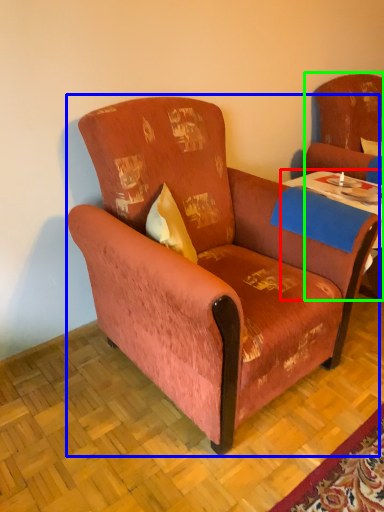
Question: Considering the real-world distances, which object is farthest from table (highlighted by a red box)? chair (highlighted by a blue box) or swivel chair (highlighted by a green box)?

Choices:
 (A) chair
 (B) swivel chair

Answer: (A)